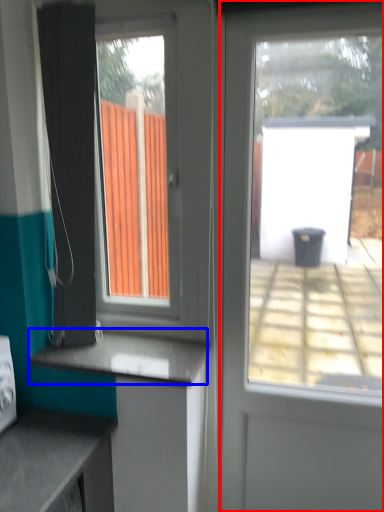
Question: Which object is closer to the camera taking this photo, door (highlighted by a red box) or counter top (highlighted by a blue box)?

Choices:
 (A) door
 (B) counter top

Answer: (A)